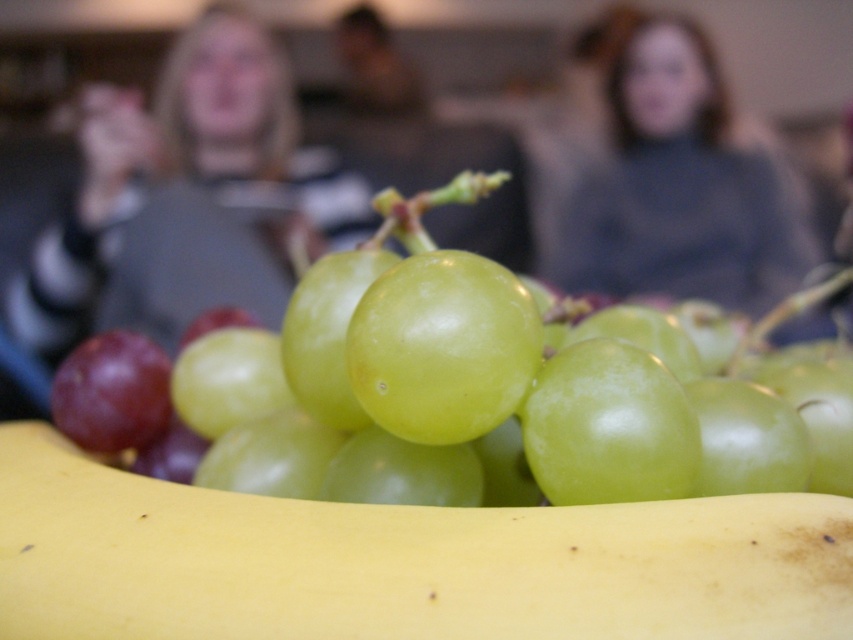
Question: Can you confirm if green shiny grape at center is positioned below smooth gray sweater at upper center?

Choices:
 (A) no
 (B) yes

Answer: (B)

Question: Estimate the real-world distances between objects in this image. Which object is farther from the matte gray sweater at upper center?

Choices:
 (A) green shiny grape at center
 (B) yellow smooth banana at bottom
 (C) smooth gray sweater at upper center

Answer: (B)

Question: Is the position of yellow smooth banana at bottom less distant than that of matte gray sweater at upper center?

Choices:
 (A) yes
 (B) no

Answer: (A)

Question: Which is nearer to the green shiny grape at center?

Choices:
 (A) yellow smooth banana at bottom
 (B) smooth gray sweater at upper center
 (C) matte gray sweater at upper center

Answer: (A)

Question: Among these points, which one is nearest to the camera?

Choices:
 (A) (747, 300)
 (B) (241, 211)
 (C) (646, 461)

Answer: (C)

Question: Is smooth gray sweater at upper center smaller than matte gray sweater at upper center?

Choices:
 (A) no
 (B) yes

Answer: (A)